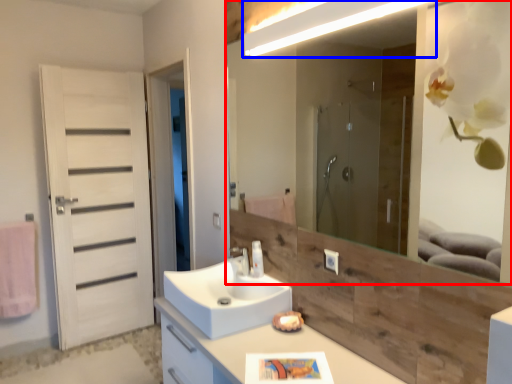
Question: Which object appears closest to the camera in this image, mirror (highlighted by a red box) or light fixture (highlighted by a blue box)?

Choices:
 (A) mirror
 (B) light fixture

Answer: (A)